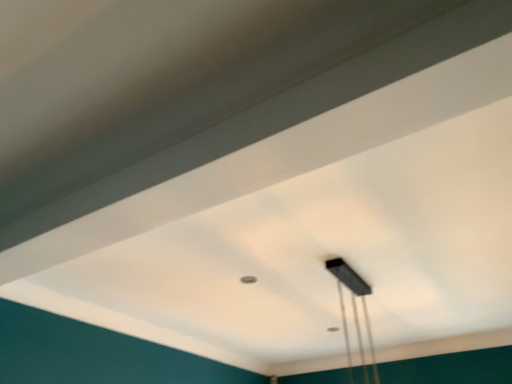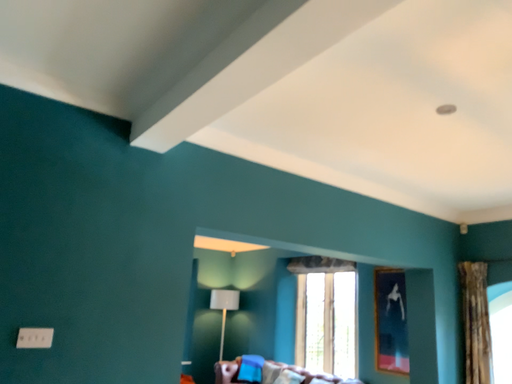
Question: Which way did the camera rotate in the video?

Choices:
 (A) rotated left
 (B) rotated right

Answer: (A)